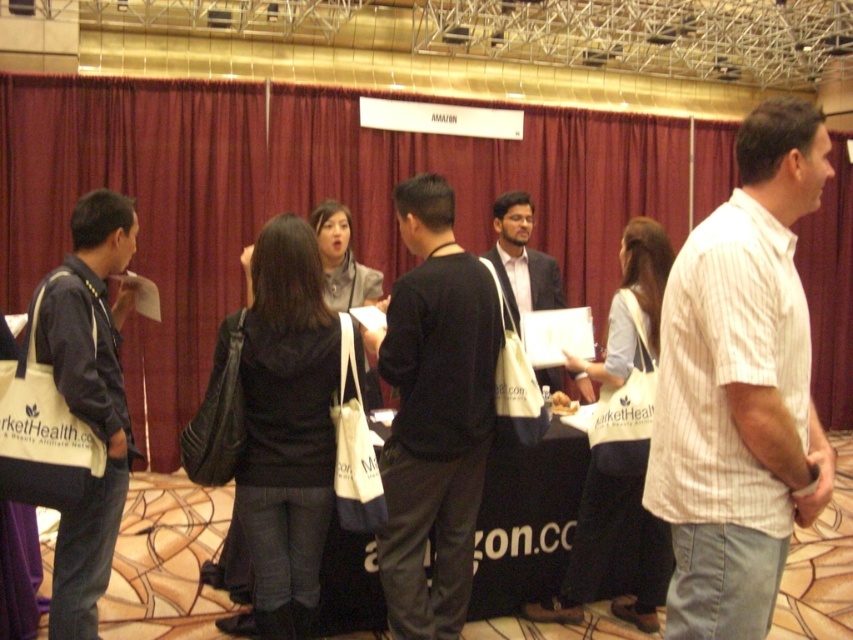
You are organizing a photoshoot and need to place a 2ft wide backdrop stand between the white striped shirt at right and the dark blue suit at center. Given their sizes, will the stand fit without overlapping either?

The white striped shirt at right is wider than the dark blue suit at center. The stand requires 2ft of space. Since the white striped shirt at right is wider, the total space between them may accommodate the stand, but exact placement depends on their exact positions. However, based on width alone, the stand could fit if positioned between them without overlapping the wider shirt.

You are a photographer at the event and need to capture a photo of both the white striped shirt at right and the dark blue suit at center. Which person should you focus on first to ensure both are in frame?

The white striped shirt at right is taller than the dark blue suit at center, so focus on the white striped shirt at right first to ensure both are in frame.

Consider the image. You are at the event and want to hand out promotional materials. You need to place a stack of brochures on the table so that both the black matte shirt at center and the matte black jacket at left can easily reach them. Considering their heights, where should you place the stack?

The black matte shirt at center is much taller than the matte black jacket at left, so placing the stack of brochures closer to the center of the table would ensure both can reach it comfortably without leaning too far.